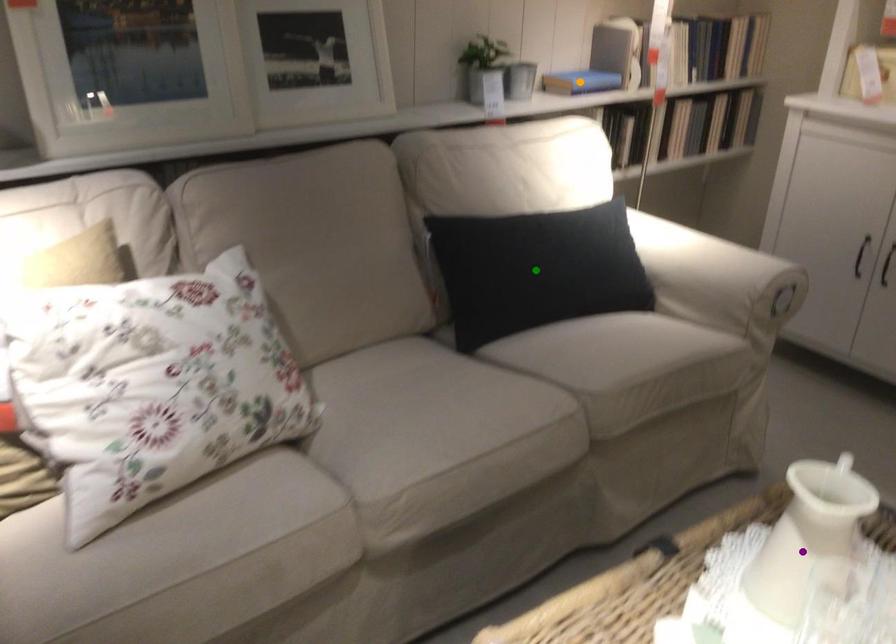
Order these from nearest to farthest:
A) green point
B) purple point
C) orange point

purple point
green point
orange point